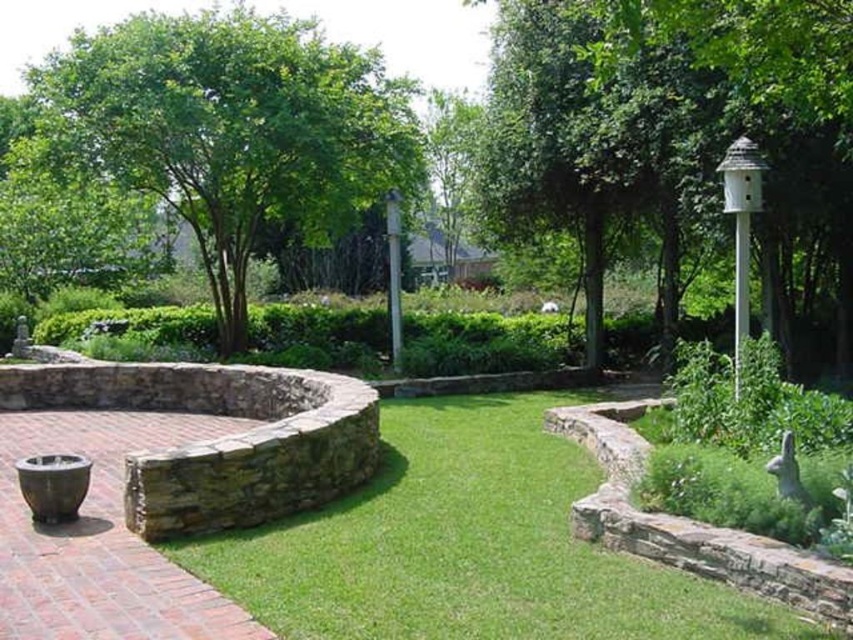
Question: Among these points, which one is farthest from the camera?

Choices:
 (A) (675, 61)
 (B) (149, 58)
 (C) (120, 385)
 (D) (548, 536)

Answer: (B)

Question: Is white wood birdhouse at upper right closer to the viewer compared to rustic stone fire pit at lower left?

Choices:
 (A) no
 (B) yes

Answer: (B)

Question: Which point is closer to the camera taking this photo?

Choices:
 (A) (135, 371)
 (B) (234, 125)
 (C) (548, 145)

Answer: (A)

Question: Which point is farther from the camera taking this photo?

Choices:
 (A) (831, 632)
 (B) (57, 374)
 (C) (668, 323)
 (D) (277, 102)

Answer: (C)

Question: Does green grass at center have a larger size compared to green leafy tree at upper left?

Choices:
 (A) yes
 (B) no

Answer: (B)

Question: Is white wood birdhouse at upper right smaller than green leafy tree at upper left?

Choices:
 (A) no
 (B) yes

Answer: (B)